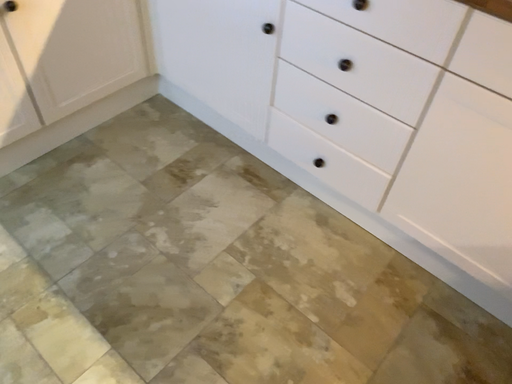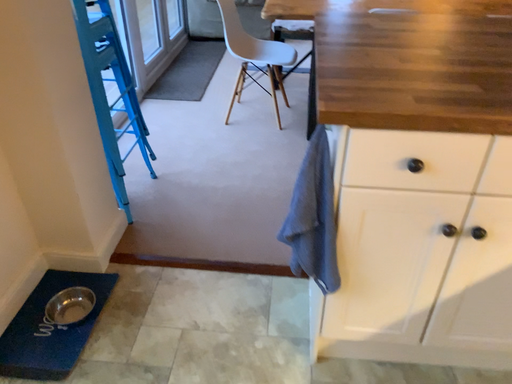
Question: Which way did the camera rotate in the video?

Choices:
 (A) rotated downward
 (B) rotated upward

Answer: (B)